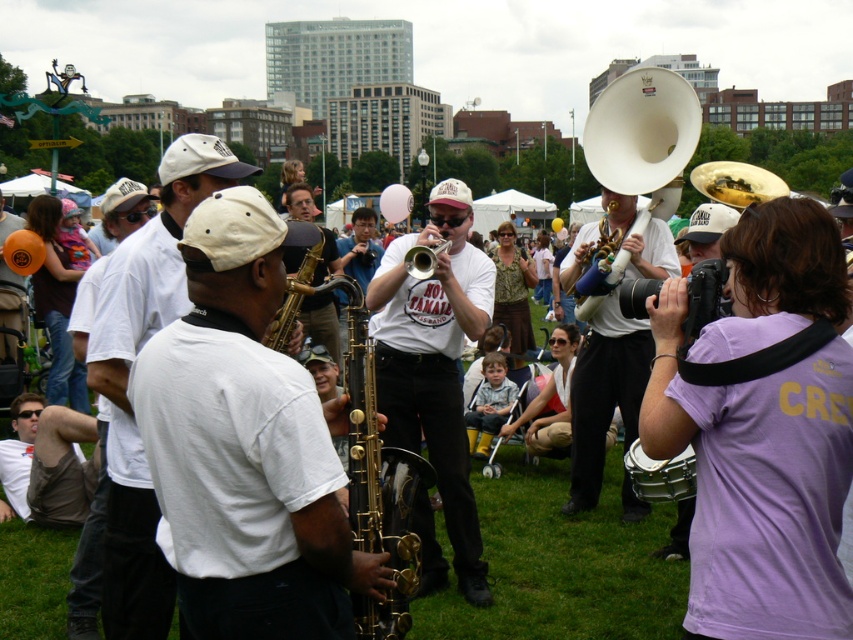
You are a photographer at the event and you want to capture both the gold shiny trumpet at center and the matte gold tuba at center in a single photo. Which instrument should you focus on first to ensure it appears larger in the photo?

The gold shiny trumpet at center is much taller than the matte gold tuba at center, so you should focus on the gold shiny trumpet at center first to ensure it appears larger in the photo.

You are a photographer at the event and want to capture the gold shiny trumpet at center and the matte gold tuba at center in a single frame. Based on their positions, which one is closer to the camera?

The gold shiny trumpet at center is positioned under the matte gold tuba at center, so the matte gold tuba at center is closer to the camera.